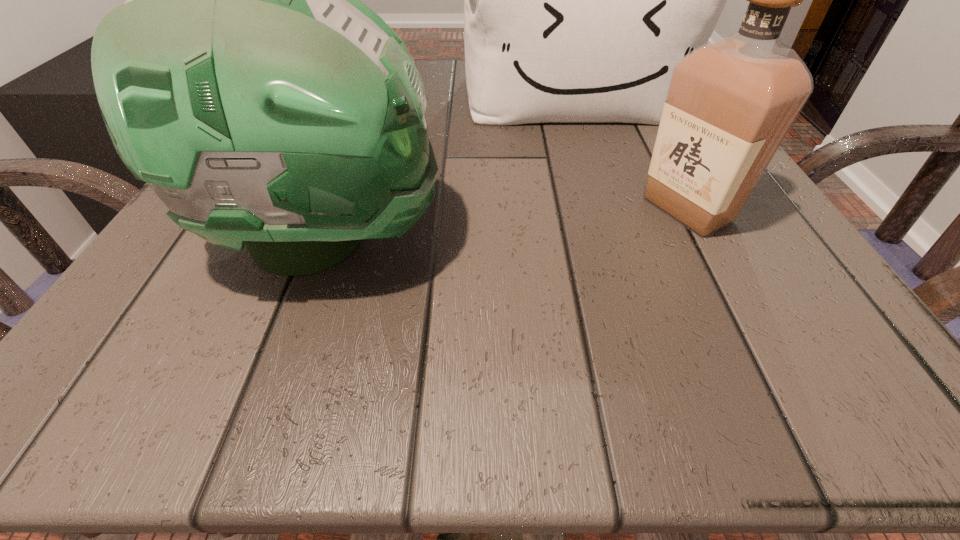
Where is `empty location between the liquor and the cushion`? empty location between the liquor and the cushion is located at coordinates (630, 151).

Point out which object is positioned as the second nearest to the liquor. Please provide its 2D coordinates. Your answer should be formatted as a tuple, i.e. [(x, y)], where the tuple contains the x and y coordinates of a point satisfying the conditions above.

[(243, 79)]

Point out which object is positioned as the second nearest to the liquor. Please provide its 2D coordinates. Your answer should be formatted as a tuple, i.e. [(x, y)], where the tuple contains the x and y coordinates of a point satisfying the conditions above.

[(243, 79)]

I want to click on vacant space that satisfies the following two spatial constraints: 1. on the side of the farthest object with the smiley face; 2. on the visor of the football helmet, so click(x=622, y=239).